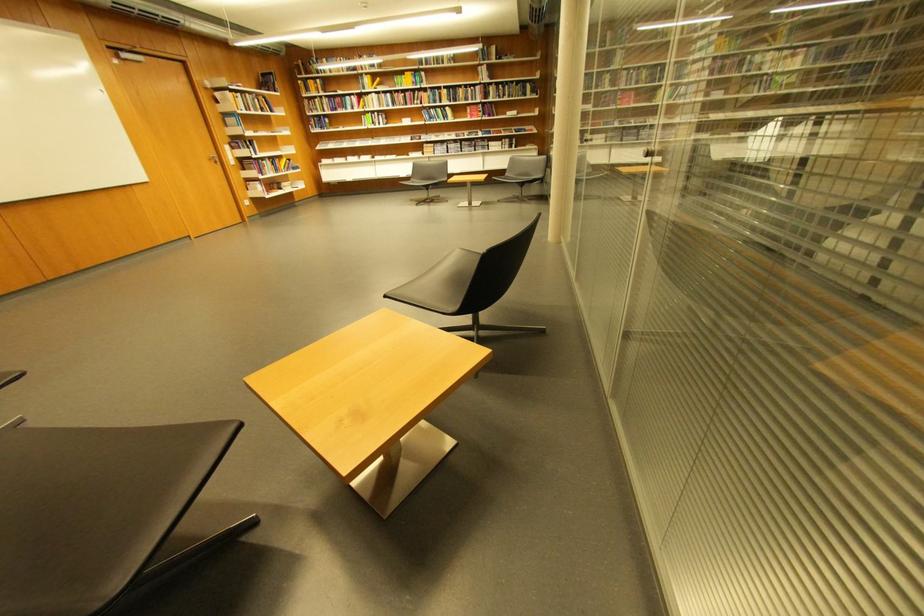
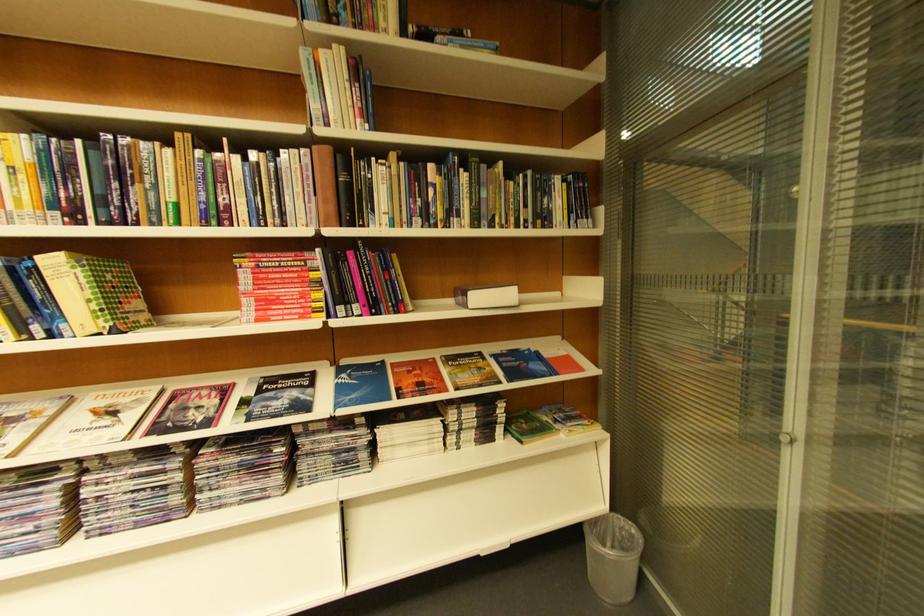
In the second image, find the point that corresponds to pixel 457 110 in the first image.

(63, 264)